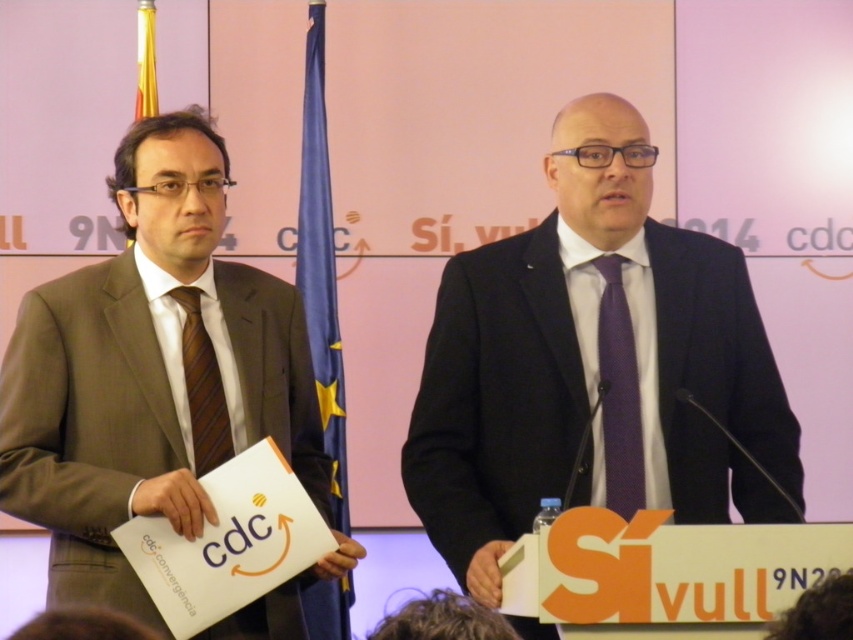
Question: Which point appears farthest from the camera in this image?

Choices:
 (A) (142, 157)
 (B) (648, 394)
 (C) (622, 324)
 (D) (219, 410)

Answer: (C)

Question: Can you confirm if brown suit at left is positioned above brownstriped fabrictie at left?

Choices:
 (A) no
 (B) yes

Answer: (B)

Question: Which of these objects is positioned farthest from the purple silk tie at center?

Choices:
 (A) brownstriped fabrictie at left
 (B) matte black suit at center
 (C) brown suit at left

Answer: (C)

Question: Does purple silk tie at center have a greater width compared to brownstriped fabrictie at left?

Choices:
 (A) yes
 (B) no

Answer: (B)

Question: Which object appears farthest from the camera in this image?

Choices:
 (A) purple silk tie at center
 (B) brownstriped fabrictie at left

Answer: (B)

Question: Does brown suit at left have a larger size compared to brownstriped fabrictie at left?

Choices:
 (A) yes
 (B) no

Answer: (A)